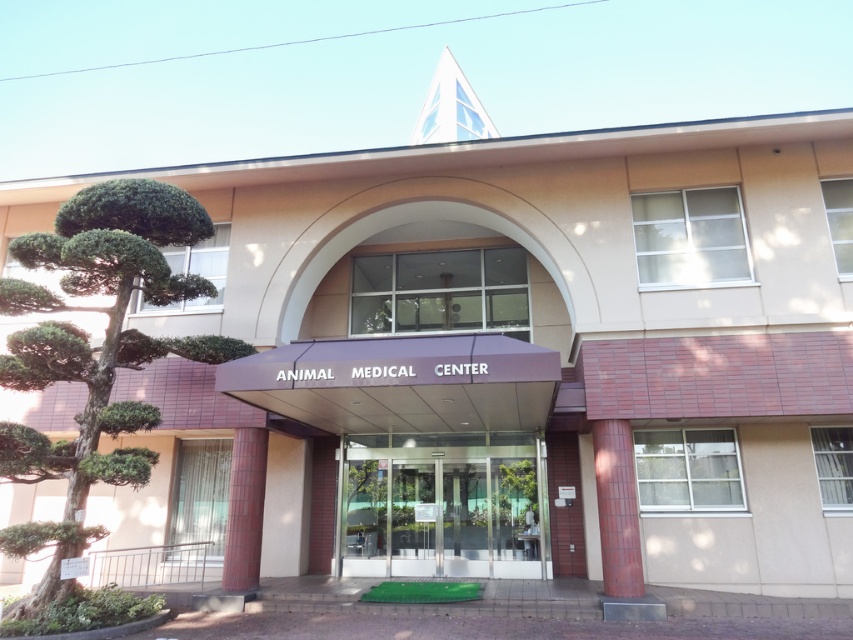
Question: Which of the following is the closest to the observer?

Choices:
 (A) green leafy tree at left
 (B) transparent glass door at center

Answer: (A)

Question: Can you confirm if green leafy tree at left is wider than transparent glass door at center?

Choices:
 (A) yes
 (B) no

Answer: (B)

Question: Does green leafy tree at left lie behind transparent glass door at center?

Choices:
 (A) yes
 (B) no

Answer: (B)

Question: Does green leafy tree at left lie behind transparent glass door at center?

Choices:
 (A) no
 (B) yes

Answer: (A)

Question: Which object appears farthest from the camera in this image?

Choices:
 (A) transparent glass door at center
 (B) green leafy tree at left

Answer: (A)